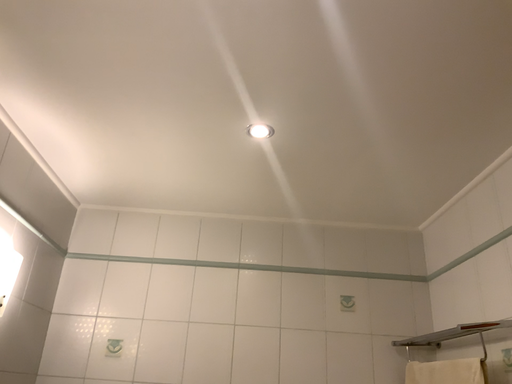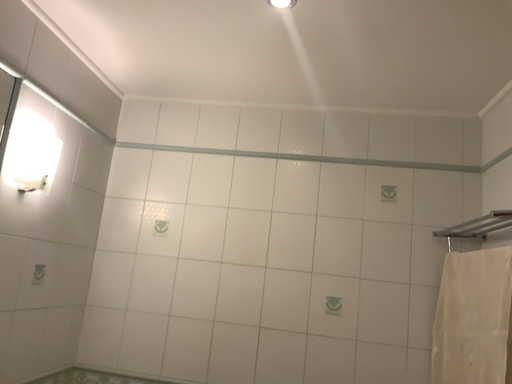
Question: Which way did the camera rotate in the video?

Choices:
 (A) rotated left
 (B) rotated right

Answer: (A)